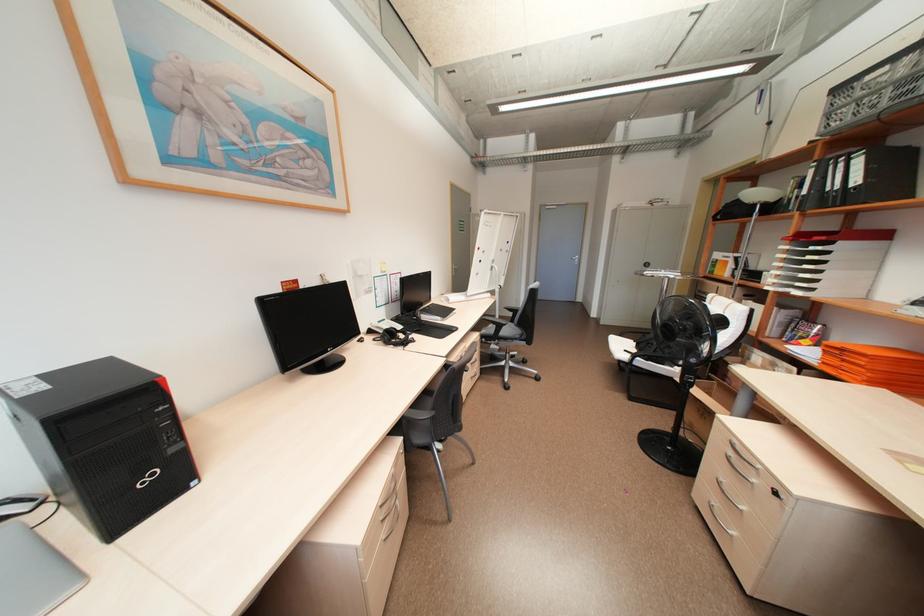
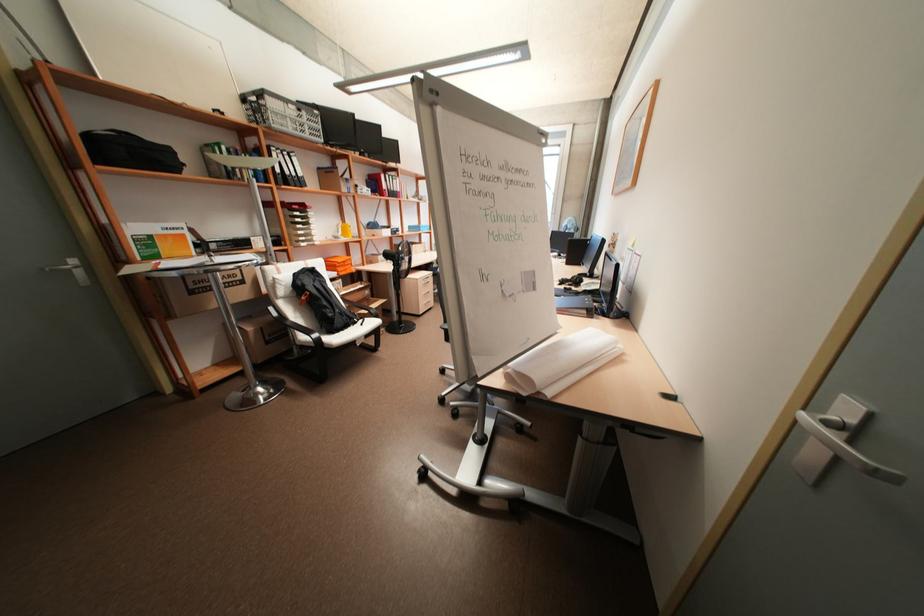
In the second image, find the point that corresponds to point 847,164 in the first image.

(293, 158)